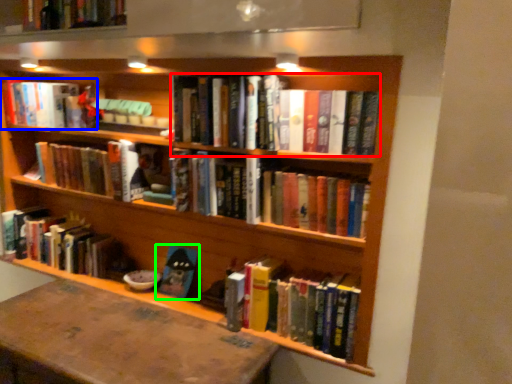
Question: Considering the real-world distances, which object is closest to book (highlighted by a red box)? book (highlighted by a blue box) or book (highlighted by a green box).

Choices:
 (A) book
 (B) book

Answer: (B)